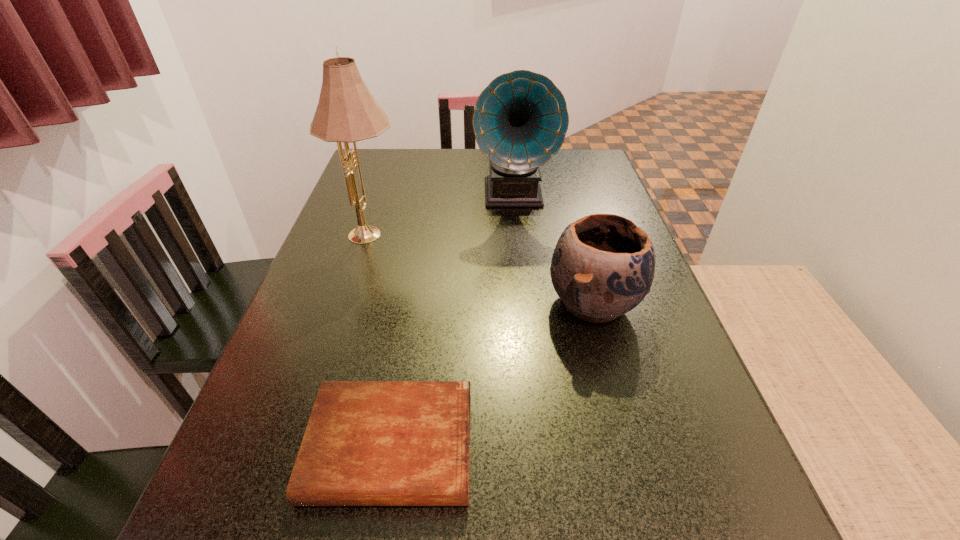
This screenshot has height=540, width=960. What are the coordinates of `lampshade` in the screenshot? It's located at (346, 112).

This screenshot has height=540, width=960. Identify the location of the second tallest object. (520, 120).

Image resolution: width=960 pixels, height=540 pixels. Find the location of `pottery`. pottery is located at coordinates (603, 265).

Where is `the second shortest object`? the second shortest object is located at coordinates (603, 265).

In order to click on the nearest object in this screenshot , I will do `click(367, 443)`.

Locate an element on the screen. The width and height of the screenshot is (960, 540). Bible is located at coordinates (367, 443).

Locate an element on the screen. The image size is (960, 540). free location located 0.180m on the right of the tallest object is located at coordinates (477, 234).

Where is `free location located 0.050m from the horn of the phonograph_record`? free location located 0.050m from the horn of the phonograph_record is located at coordinates (517, 232).

You are a GUI agent. You are given a task and a screenshot of the screen. Output one action in this format:
    pyautogui.click(x=<x>, y=<y>)
    Task: Click on the vacant space located on the left of the second nearest object
    Image resolution: width=960 pixels, height=540 pixels.
    Given the screenshot: What is the action you would take?
    pyautogui.click(x=509, y=303)

I want to click on object that is at the far edge, so click(520, 120).